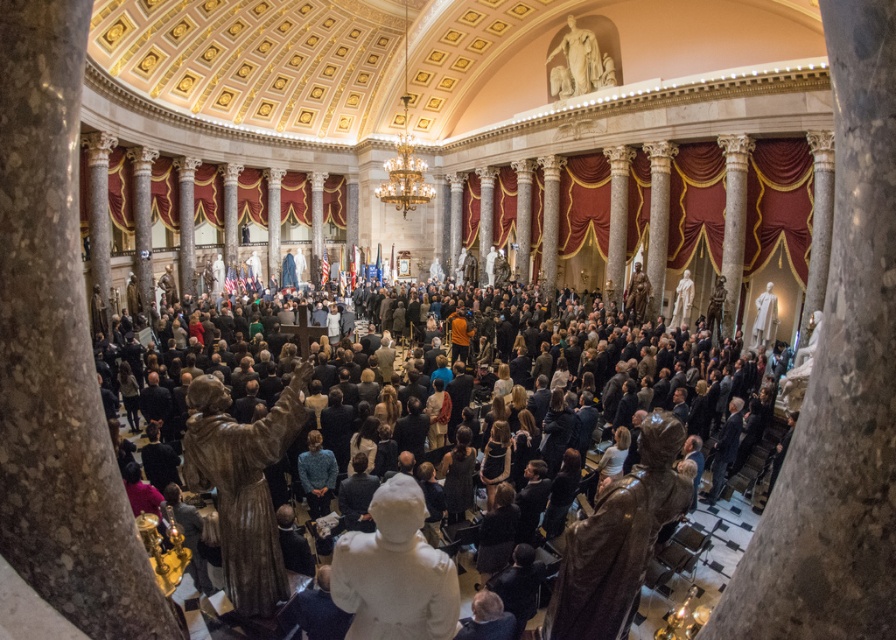
Question: Among these objects, which one is nearest to the camera?

Choices:
 (A) white marble statue at upper center
 (B) white marble statue at center
 (C) bronze statue at center

Answer: (B)

Question: Can you confirm if bronze statue at center is positioned above brown statue at center?

Choices:
 (A) no
 (B) yes

Answer: (B)

Question: Is bronze statue at center wider than white marble statue at upper center?

Choices:
 (A) yes
 (B) no

Answer: (A)

Question: Which object is positioned farthest from the black matte crowd at center?

Choices:
 (A) white marble statue at center
 (B) brown statue at center
 (C) white marble statue at upper center
 (D) bronze statue at center

Answer: (C)

Question: In this image, where is black matte crowd at center located relative to white marble statue at upper center?

Choices:
 (A) below
 (B) above

Answer: (A)

Question: Which point appears closest to the camera in this image?

Choices:
 (A) (437, 580)
 (B) (618, 570)
 (C) (610, 48)

Answer: (B)